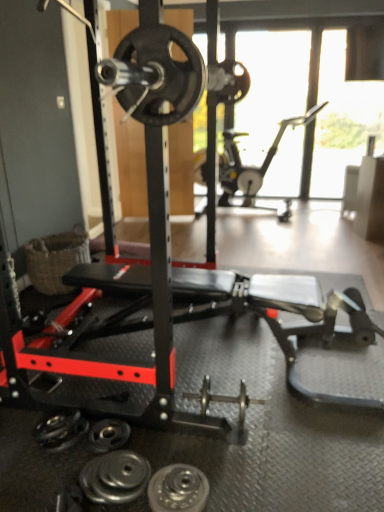
Identify the location of vacant region to the left of polished silver dumbbell at lower left, the first dumbbell viewed from the left. This screenshot has height=512, width=384. (55, 481).